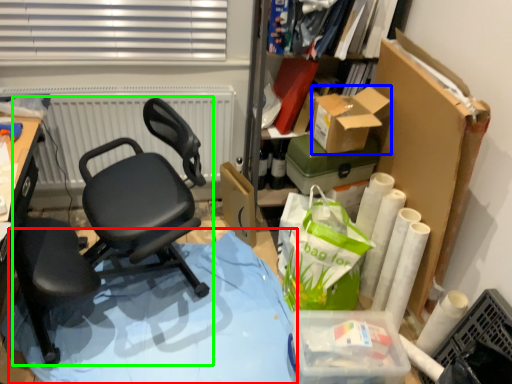
Question: Based on their relative distances, which object is farther from table (highlighted by a red box)? Choose from box (highlighted by a blue box) and chair (highlighted by a green box).

Choices:
 (A) box
 (B) chair

Answer: (A)